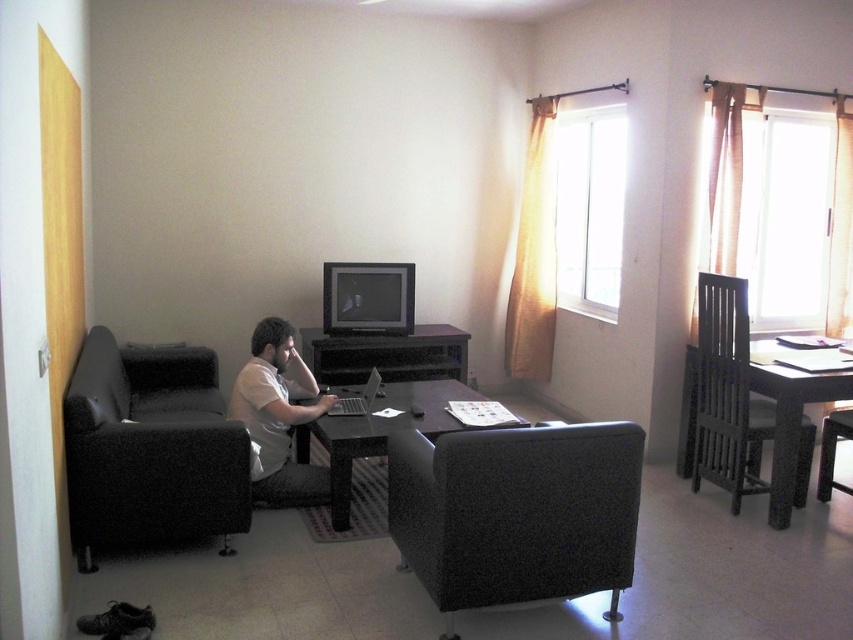
Question: Can you confirm if black glossy table at center is positioned above silver metallic laptop at center?

Choices:
 (A) yes
 (B) no

Answer: (B)

Question: Which point is farther from the camera taking this photo?

Choices:
 (A) (457, 525)
 (B) (474, 396)
 (C) (306, 392)

Answer: (B)

Question: Estimate the real-world distances between objects in this image. Which object is farther from the black fabric couch at left?

Choices:
 (A) white matte shirt at center
 (B) black textured armchair at lower center
 (C) black wooden table at right

Answer: (C)

Question: Can you confirm if black textured armchair at lower center is smaller than black glossy table at center?

Choices:
 (A) no
 (B) yes

Answer: (B)

Question: Which of the following is the farthest from the observer?

Choices:
 (A) (264, 342)
 (B) (339, 404)

Answer: (B)

Question: Does black textured armchair at lower center have a lesser width compared to black fabric chair at lower right?

Choices:
 (A) no
 (B) yes

Answer: (A)